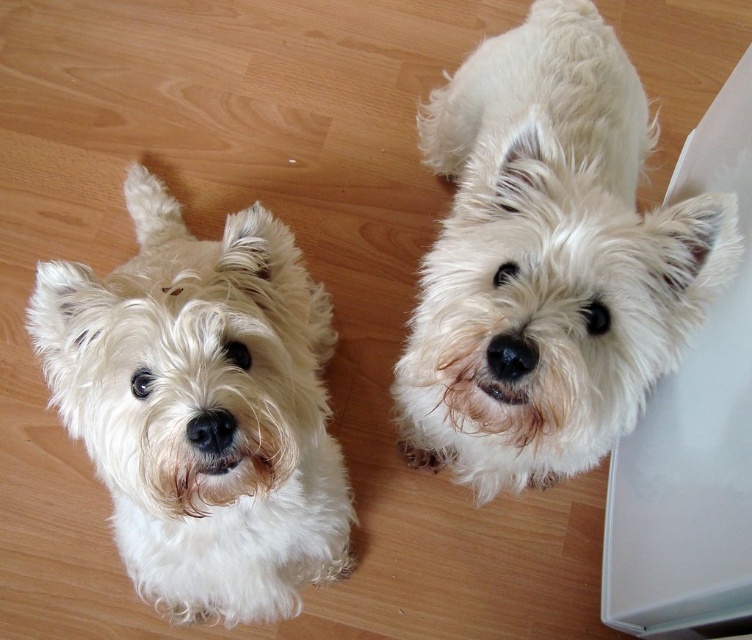
You are a dog trainer and need to place a treat between two white fluffy dogs. The treat requires a minimum of 12 inches of space to avoid them fighting. Based on the scene, can you safely place the treat between the white fluffy dog at upper center and the white fluffy dog at center?

The distance between the white fluffy dog at upper center and the white fluffy dog at center is 14.32 inches, which is greater than the required 12 inches. Therefore, you can safely place the treat between them without causing a fight.

You are a photographer standing 36 inches away from the camera. You want to take a closeup photo of the white fluffy dog at upper center. Can you reach the dog without moving your position?

The white fluffy dog at upper center is 32.33 inches away from the camera. Since you are standing 36 inches away from the camera, you are 3.67 inches too far to reach the dog without moving closer.